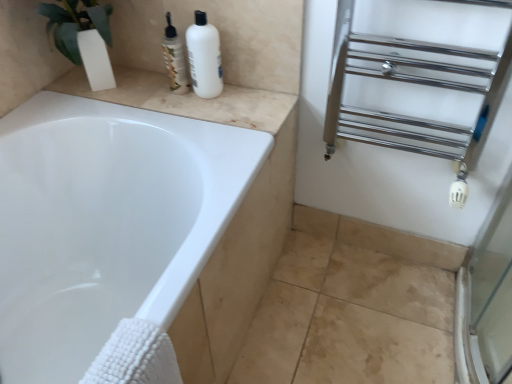
I want to click on free spot below chrome/metal towel rack at right (from a real-world perspective), so click(x=367, y=266).